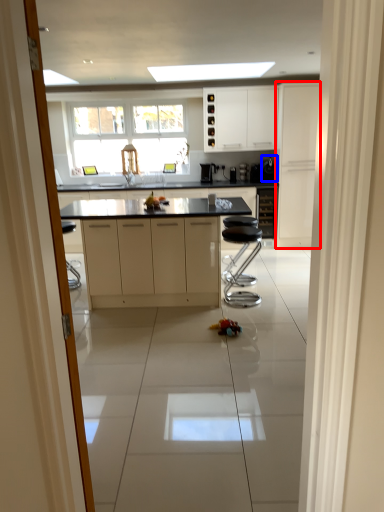
Question: Which object appears farthest to the camera in this image, cabinetry (highlighted by a red box) or appliance (highlighted by a blue box)?

Choices:
 (A) cabinetry
 (B) appliance

Answer: (B)